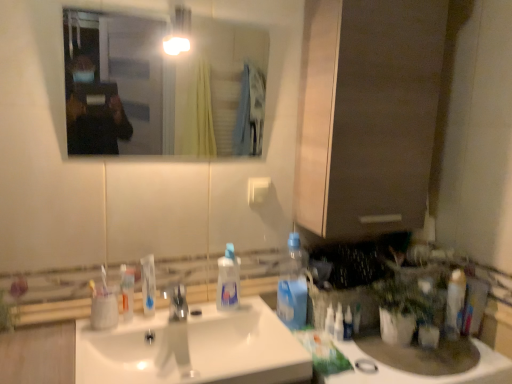
This screenshot has width=512, height=384. What are the coordinates of `vacant space that's between transparent plastic spray bottle at center, which is the 1th cleaning product from left to right, and polished chrome faucet at center` in the screenshot? It's located at (211, 319).